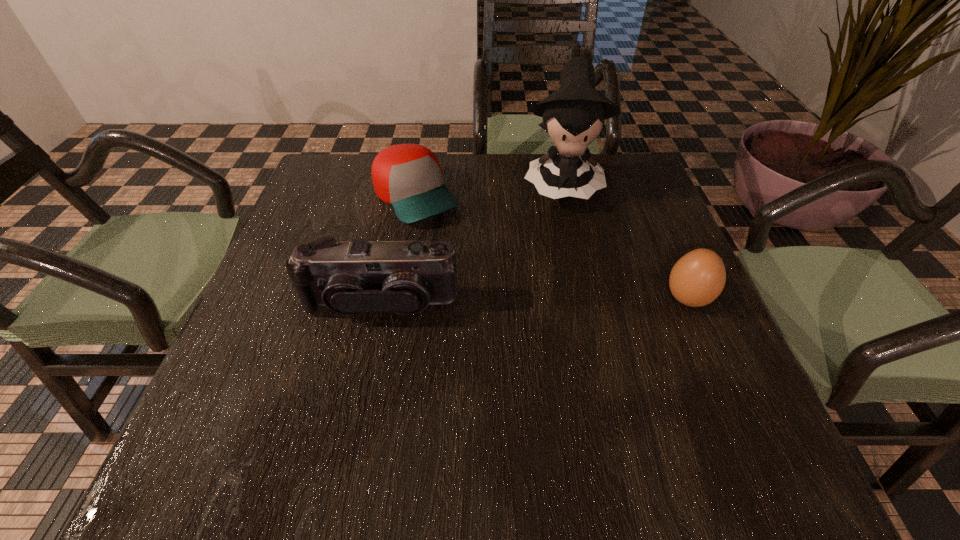
Identify the location of vacant region between the tallest object and the baseball cap. The height and width of the screenshot is (540, 960). tap(489, 190).

Identify the location of free point between the camcorder and the boiled egg. This screenshot has height=540, width=960. click(x=534, y=301).

This screenshot has width=960, height=540. Identify the location of vacant area that lies between the camcorder and the second object from right to left. (470, 242).

At what (x,y) coordinates should I click in order to perform the action: click on free point between the camcorder and the doll. Please return your answer as a coordinate pair (x, y). The height and width of the screenshot is (540, 960). Looking at the image, I should click on (470, 242).

Locate an element on the screen. empty space between the tallest object and the boiled egg is located at coordinates (624, 240).

This screenshot has height=540, width=960. What are the coordinates of `empty location between the second object from right to left and the boiled egg` in the screenshot? It's located at (624, 240).

Where is `the closest object to the camcorder`? The width and height of the screenshot is (960, 540). the closest object to the camcorder is located at coordinates (408, 177).

Find the location of a particular element. object that is the second closest to the tallest object is located at coordinates (697, 279).

The width and height of the screenshot is (960, 540). In order to click on vacant space that satisfies the following two spatial constraints: 1. on the front side of the doll; 2. on the right side of the boiled egg in this screenshot , I will do `click(588, 299)`.

Where is `vacant space that satisfies the following two spatial constraints: 1. on the front side of the rightmost object; 2. on the left side of the third object from left to right`? The height and width of the screenshot is (540, 960). vacant space that satisfies the following two spatial constraints: 1. on the front side of the rightmost object; 2. on the left side of the third object from left to right is located at coordinates (588, 299).